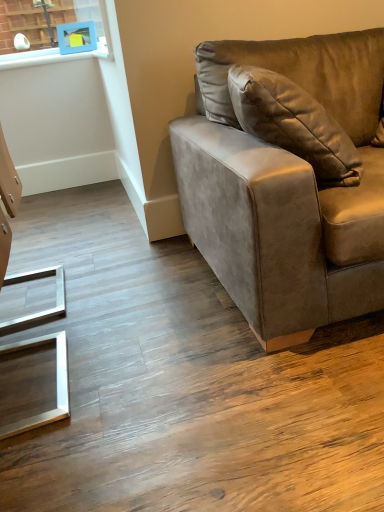
Question: Is point (357, 112) closer or farther from the camera than point (61, 46)?

Choices:
 (A) farther
 (B) closer

Answer: (B)

Question: In terms of size, does suede-like brown couch at right appear bigger or smaller than blue plastic picture frame at upper left?

Choices:
 (A) small
 (B) big

Answer: (B)

Question: Do you think suede-like brown couch at right is within blue plastic picture frame at upper left, or outside of it?

Choices:
 (A) inside
 (B) outside

Answer: (B)

Question: Based on their sizes in the image, would you say blue plastic picture frame at upper left is bigger or smaller than suede-like brown couch at right?

Choices:
 (A) big
 (B) small

Answer: (B)

Question: From a real-world perspective, is blue plastic picture frame at upper left physically located above or below suede-like brown couch at right?

Choices:
 (A) above
 (B) below

Answer: (A)

Question: Considering their positions, is blue plastic picture frame at upper left located in front of or behind suede-like brown couch at right?

Choices:
 (A) front
 (B) behind

Answer: (B)

Question: Is blue plastic picture frame at upper left to the left or to the right of suede-like brown couch at right in the image?

Choices:
 (A) left
 (B) right

Answer: (A)